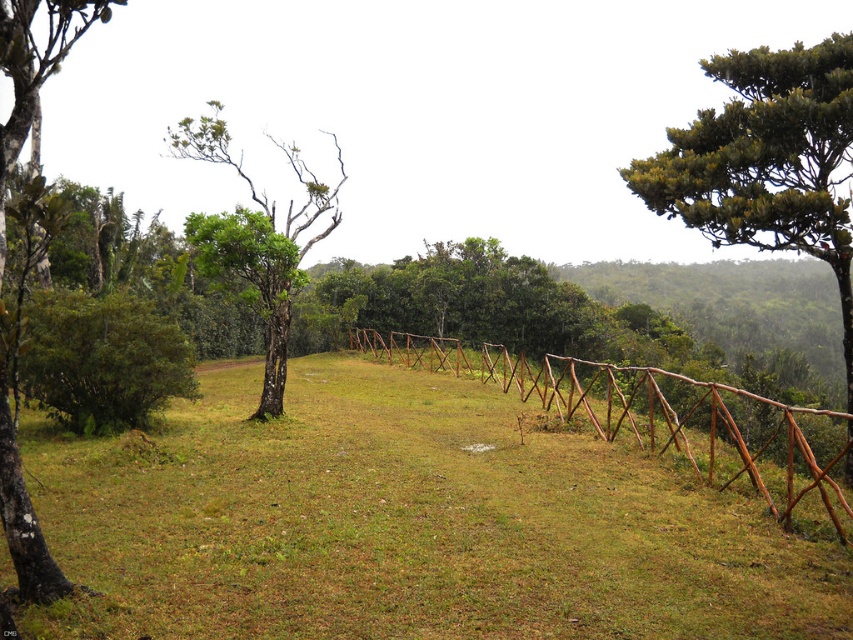
Question: Which object appears farthest from the camera in this image?

Choices:
 (A) green rough bark tree at left
 (B) green matte tree at center

Answer: (B)

Question: Observing the image, what is the correct spatial positioning of green leafy tree at upper right in reference to green matte tree at center?

Choices:
 (A) below
 (B) above

Answer: (A)

Question: Does green grassy at center have a larger size compared to green leafy tree at upper right?

Choices:
 (A) no
 (B) yes

Answer: (A)

Question: Which is farther from the brown wooden fence at center?

Choices:
 (A) green leafy tree at upper right
 (B) green rough bark tree at left

Answer: (B)

Question: Among these points, which one is nearest to the camera?

Choices:
 (A) (39, 547)
 (B) (279, 632)
 (C) (444, 348)
 (D) (718, 205)

Answer: (A)

Question: Is green leafy tree at upper right above brown wooden fence at center?

Choices:
 (A) yes
 (B) no

Answer: (A)